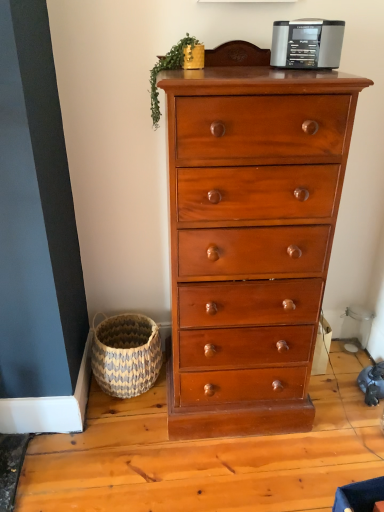
Question: Is woven natural basket at lower left taller than shiny brown wood chest of drawers at center?

Choices:
 (A) yes
 (B) no

Answer: (B)

Question: Is woven natural basket at lower left facing towards shiny brown wood chest of drawers at center?

Choices:
 (A) no
 (B) yes

Answer: (A)

Question: Considering the relative sizes of woven natural basket at lower left and shiny brown wood chest of drawers at center in the image provided, is woven natural basket at lower left thinner than shiny brown wood chest of drawers at center?

Choices:
 (A) no
 (B) yes

Answer: (B)

Question: From the image's perspective, is woven natural basket at lower left located above shiny brown wood chest of drawers at center?

Choices:
 (A) yes
 (B) no

Answer: (B)

Question: Is woven natural basket at lower left directly adjacent to shiny brown wood chest of drawers at center?

Choices:
 (A) no
 (B) yes

Answer: (A)

Question: Considering the relative positions of shiny brown wood chest of drawers at center and green leafy plant at upper center in the image provided, is shiny brown wood chest of drawers at center to the left or to the right of green leafy plant at upper center?

Choices:
 (A) right
 (B) left

Answer: (A)

Question: In terms of height, does shiny brown wood chest of drawers at center look taller or shorter compared to green leafy plant at upper center?

Choices:
 (A) short
 (B) tall

Answer: (B)

Question: Would you say shiny brown wood chest of drawers at center is inside or outside green leafy plant at upper center?

Choices:
 (A) inside
 (B) outside

Answer: (B)

Question: Is shiny brown wood chest of drawers at center wider or thinner than green leafy plant at upper center?

Choices:
 (A) thin
 (B) wide

Answer: (B)

Question: Is point (157, 116) closer or farther from the camera than point (261, 343)?

Choices:
 (A) closer
 (B) farther

Answer: (B)

Question: From a real-world perspective, is green leafy plant at upper center above or below shiny brown wood chest of drawers at center?

Choices:
 (A) above
 (B) below

Answer: (A)

Question: From the image's perspective, is green leafy plant at upper center positioned above or below shiny brown wood chest of drawers at center?

Choices:
 (A) below
 (B) above

Answer: (B)

Question: Considering the positions of green leafy plant at upper center and shiny brown wood chest of drawers at center in the image, is green leafy plant at upper center taller or shorter than shiny brown wood chest of drawers at center?

Choices:
 (A) short
 (B) tall

Answer: (A)

Question: Is metallic gray radio at upper center bigger or smaller than shiny brown wood chest of drawers at center?

Choices:
 (A) small
 (B) big

Answer: (A)

Question: Based on their positions, is metallic gray radio at upper center located to the left or right of shiny brown wood chest of drawers at center?

Choices:
 (A) right
 (B) left

Answer: (A)